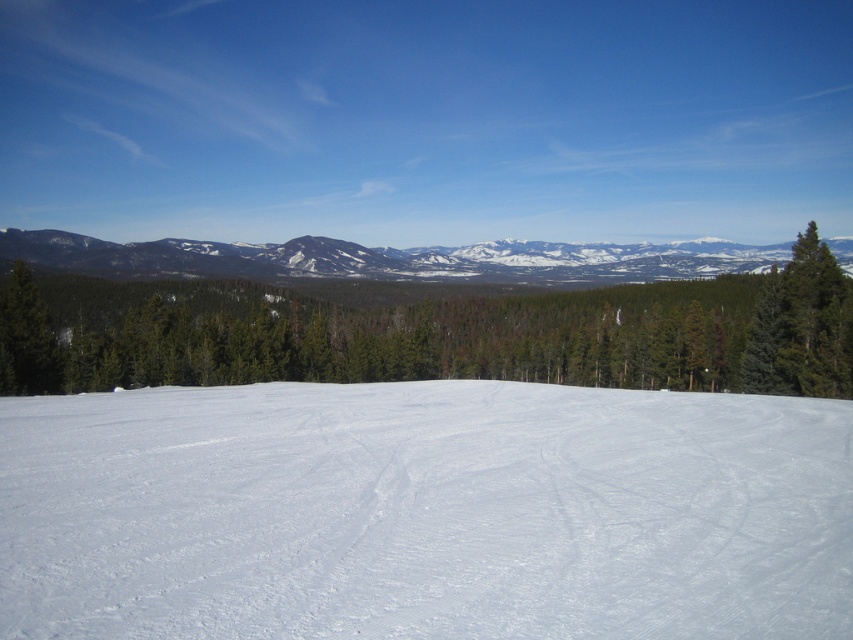
Question: Which object is positioned farthest from the green matte tree at center?

Choices:
 (A) snowy rocky mountain at upper center
 (B) white smooth snow at center

Answer: (B)

Question: Which of the following is the closest to the observer?

Choices:
 (A) snowy rocky mountain at upper center
 (B) green matte tree at center
 (C) white smooth snow at center

Answer: (C)

Question: Which is nearer to the green matte tree at center?

Choices:
 (A) snowy rocky mountain at upper center
 (B) white smooth snow at center

Answer: (A)

Question: Can you confirm if white smooth snow at center is positioned to the left of snowy rocky mountain at upper center?

Choices:
 (A) yes
 (B) no

Answer: (A)

Question: In this image, where is green matte tree at center located relative to snowy rocky mountain at upper center?

Choices:
 (A) right
 (B) left

Answer: (B)

Question: Is green matte tree at center to the left of snowy rocky mountain at upper center from the viewer's perspective?

Choices:
 (A) yes
 (B) no

Answer: (A)